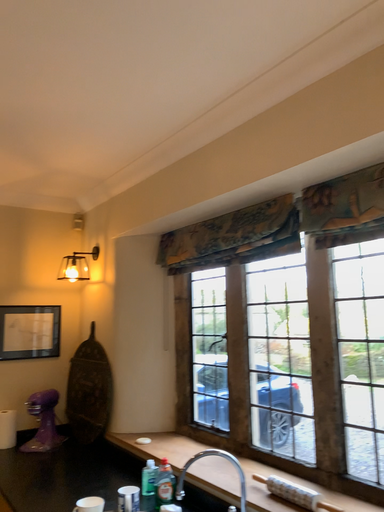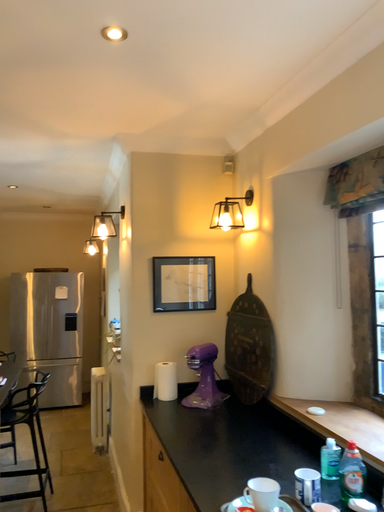
Question: Which way did the camera rotate in the video?

Choices:
 (A) rotated downward
 (B) rotated upward

Answer: (A)